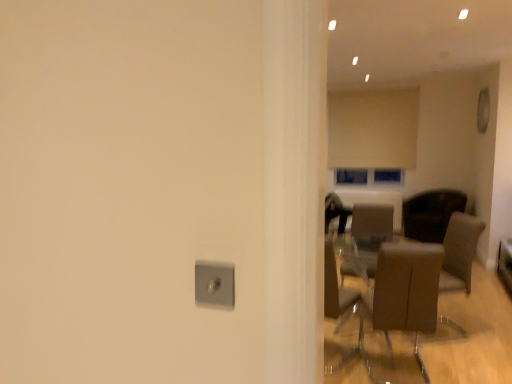
Question: Considering the relative sizes of brown fabric armchair at right and brown leather chair at center-right, which appears as the first chair when viewed from the back, in the image provided, is brown fabric armchair at right smaller than brown leather chair at center-right, which appears as the first chair when viewed from the back,?

Choices:
 (A) no
 (B) yes

Answer: (B)

Question: Is brown fabric armchair at right in front of brown leather chair at center-right, which ranks as the 1th chair in right-to-left order?

Choices:
 (A) no
 (B) yes

Answer: (B)

Question: Is brown fabric armchair at right not inside brown leather chair at center-right, which appears as the first chair when viewed from the back?

Choices:
 (A) no
 (B) yes

Answer: (B)

Question: Is brown fabric armchair at right turned away from brown leather chair at center-right, which is the 3th chair from left to right?

Choices:
 (A) yes
 (B) no

Answer: (B)

Question: Is brown fabric armchair at right thinner than brown leather chair at center-right, which is the 3th chair from left to right?

Choices:
 (A) no
 (B) yes

Answer: (B)

Question: From the image's perspective, is satin silver outlet at center located above or below brown leather chair at center-right, which ranks as the 1th chair in right-to-left order?

Choices:
 (A) below
 (B) above

Answer: (B)

Question: Looking at their shapes, would you say satin silver outlet at center is wider or thinner than brown leather chair at center-right, which ranks as the 1th chair in right-to-left order?

Choices:
 (A) wide
 (B) thin

Answer: (B)

Question: In the image, is satin silver outlet at center positioned in front of or behind brown leather chair at center-right, the third chair from the front?

Choices:
 (A) front
 (B) behind

Answer: (A)

Question: In the image, is satin silver outlet at center on the left side or the right side of brown leather chair at center-right, which appears as the first chair when viewed from the back?

Choices:
 (A) right
 (B) left

Answer: (B)

Question: Looking at their shapes, would you say beige fabric curtain at upper center is wider or thinner than brown leather chair at center, which ranks as the 2th chair in left-to-right order?

Choices:
 (A) thin
 (B) wide

Answer: (A)

Question: From the image's perspective, is beige fabric curtain at upper center located above or below brown leather chair at center, placed as the 2th chair when sorted from right to left?

Choices:
 (A) below
 (B) above

Answer: (B)

Question: Considering the positions of point (369, 157) and point (373, 266), is point (369, 157) closer or farther from the camera than point (373, 266)?

Choices:
 (A) farther
 (B) closer

Answer: (A)

Question: Relative to brown leather chair at center, which appears as the second chair when viewed from the back, is beige fabric curtain at upper center in front or behind?

Choices:
 (A) front
 (B) behind

Answer: (B)

Question: Based on their sizes in the image, would you say beige fabric curtain at upper center is bigger or smaller than satin silver outlet at center?

Choices:
 (A) small
 (B) big

Answer: (B)

Question: Looking at their shapes, would you say beige fabric curtain at upper center is wider or thinner than satin silver outlet at center?

Choices:
 (A) wide
 (B) thin

Answer: (A)